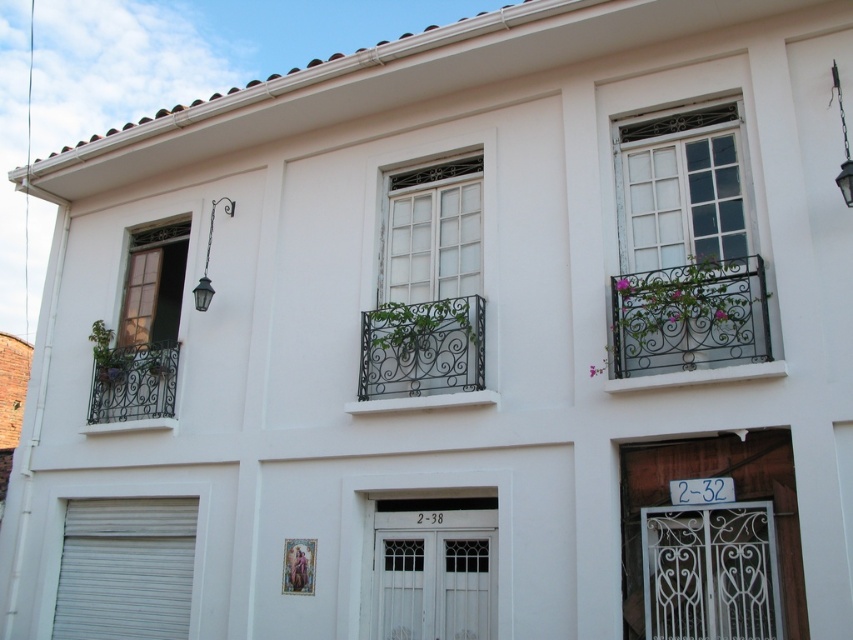
You are standing in front of the two story white building and want to enter through the front door. Which object, the black wrought iron balcony at center or the matte glass window at left, is closer to you as you approach the building?

The black wrought iron balcony at center is closer to the viewer than the matte glass window at left, so the balcony is closer as you approach the building.

You are standing in front of the two balconies on the building. Which balcony, the wrought iron balcony at upper right or the black wrought iron balcony at center, is positioned closer to you?

The wrought iron balcony at upper right is closer to the viewer than the black wrought iron balcony at center.

You are standing in front of the two balconies. The black wrought iron balcony at center and the wrought iron balcony at left. Which one is taller?

The black wrought iron balcony at center is much taller than the wrought iron balcony at left.